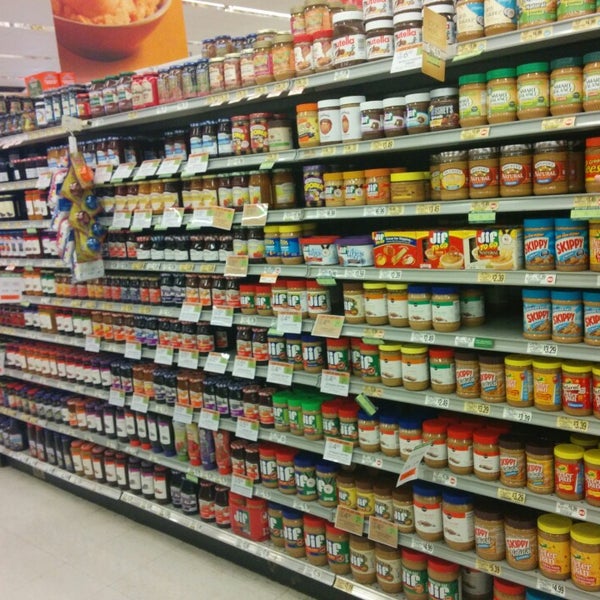
At what (x,y) coordinates should I click in order to perform the action: click on poster. Please return your answer as a coordinate pair (x, y). Looking at the image, I should click on (167, 37).